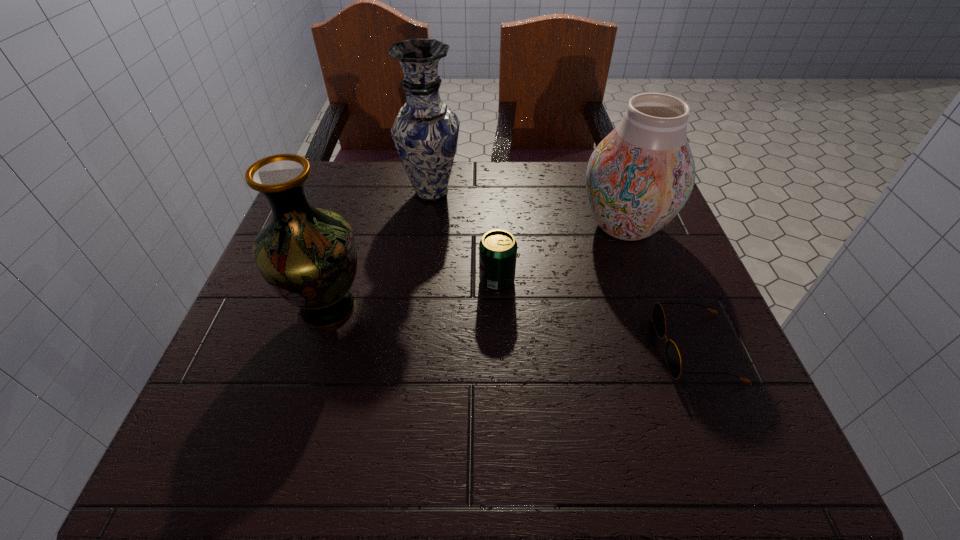
Where is `vacant space in between the rightmost vase and the shortest object`? The height and width of the screenshot is (540, 960). vacant space in between the rightmost vase and the shortest object is located at coordinates (660, 287).

Image resolution: width=960 pixels, height=540 pixels. Identify the location of free space between the leftmost object and the rightmost vase. (476, 267).

You are a GUI agent. You are given a task and a screenshot of the screen. Output one action in this format:
    pyautogui.click(x=<x>, y=<y>)
    Task: Click on the free space between the beer can and the rightmost vase
    The width and height of the screenshot is (960, 540).
    Given the screenshot: What is the action you would take?
    pyautogui.click(x=561, y=253)

What are the coordinates of `object identified as the closest to the shortest object` in the screenshot? It's located at (639, 177).

Locate which object is the fourth closest to the rightmost vase. Please provide its 2D coordinates. Your answer should be formatted as a tuple, i.e. [(x, y)], where the tuple contains the x and y coordinates of a point satisfying the conditions above.

[(307, 255)]

Locate which vase ranks in proximity to the beer can. Please provide its 2D coordinates. Your answer should be formatted as a tuple, i.e. [(x, y)], where the tuple contains the x and y coordinates of a point satisfying the conditions above.

[(639, 177)]

In order to click on vase that is the closest to the second shortest object in this screenshot , I will do `click(639, 177)`.

The width and height of the screenshot is (960, 540). I want to click on free point that satisfies the following two spatial constraints: 1. on the back side of the nearest vase; 2. on the left side of the fourth object from right to left, so click(x=364, y=193).